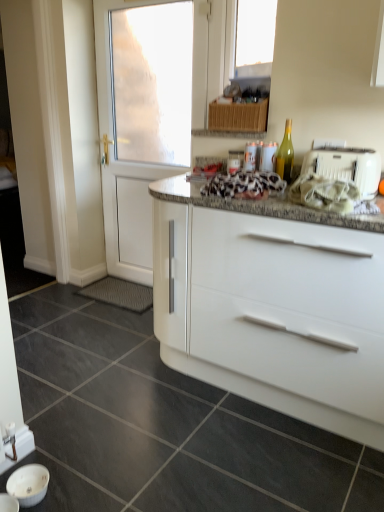
Question: Can you confirm if white plastic toaster at right is wider than green glass bottle at upper right?

Choices:
 (A) yes
 (B) no

Answer: (A)

Question: From the image's perspective, is white plastic toaster at right above green glass bottle at upper right?

Choices:
 (A) yes
 (B) no

Answer: (B)

Question: From a real-world perspective, is white plastic toaster at right beneath green glass bottle at upper right?

Choices:
 (A) yes
 (B) no

Answer: (A)

Question: Would you say white plastic toaster at right is a long distance from green glass bottle at upper right?

Choices:
 (A) yes
 (B) no

Answer: (B)

Question: Can you confirm if white plastic toaster at right is shorter than green glass bottle at upper right?

Choices:
 (A) yes
 (B) no

Answer: (A)

Question: Is granite at center wider or thinner than transparent glass window at upper center?

Choices:
 (A) thin
 (B) wide

Answer: (B)

Question: In terms of height, does granite at center look taller or shorter compared to transparent glass window at upper center?

Choices:
 (A) short
 (B) tall

Answer: (A)

Question: From the image's perspective, is granite at center located above or below transparent glass window at upper center?

Choices:
 (A) above
 (B) below

Answer: (B)

Question: Is granite at center bigger or smaller than transparent glass window at upper center?

Choices:
 (A) big
 (B) small

Answer: (A)

Question: Visually, is white glossy door at left positioned to the left or to the right of white plastic toaster at right?

Choices:
 (A) right
 (B) left

Answer: (B)

Question: Is white glossy door at left taller or shorter than white plastic toaster at right?

Choices:
 (A) tall
 (B) short

Answer: (A)

Question: Looking at the image, does white glossy door at left seem bigger or smaller compared to white plastic toaster at right?

Choices:
 (A) small
 (B) big

Answer: (B)

Question: Considering the positions of point (201, 41) and point (372, 153), is point (201, 41) closer or farther from the camera than point (372, 153)?

Choices:
 (A) farther
 (B) closer

Answer: (A)

Question: From the image's perspective, is white glossy sink at lower left located above or below transparent glass window at upper center?

Choices:
 (A) above
 (B) below

Answer: (B)

Question: Looking at their shapes, would you say white glossy sink at lower left is wider or thinner than transparent glass window at upper center?

Choices:
 (A) thin
 (B) wide

Answer: (B)